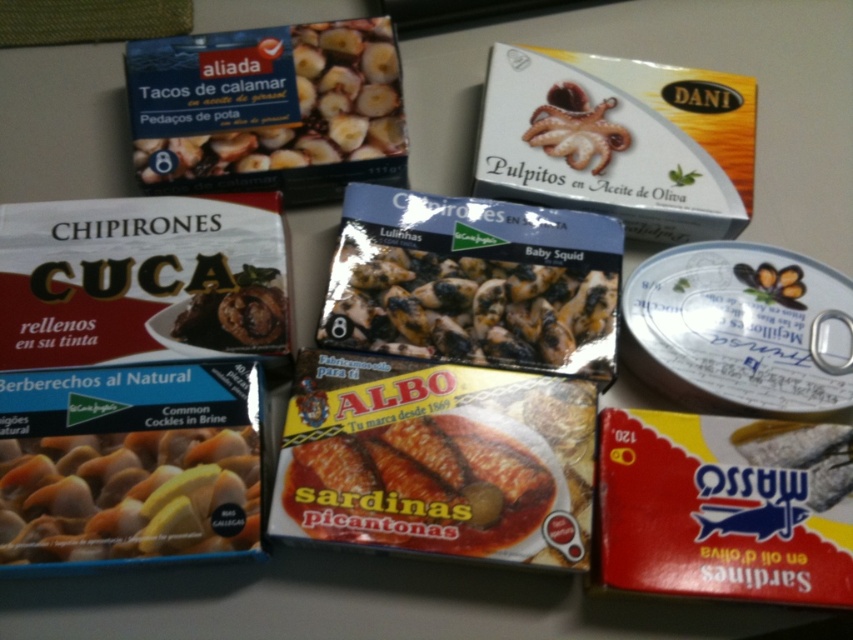
You are a delivery person who needs to place a new package between the matte white cockles at lower left and the yellowish matte sardines at center. The package is 4 inches wide. Can you fit it between them without moving the existing items?

The distance between the matte white cockles at lower left and the yellowish matte sardines at center is 8.28 inches. Since the package is 4 inches wide, it can fit comfortably within the available space without needing to move the existing items.

You are a customer looking at two products on a store shelf. You see a black matte baby squid at center and a yellowish matte sardines at center. Which one has a greater height?

The black matte baby squid at center is much taller than the yellowish matte sardines at center, so it has a greater height.